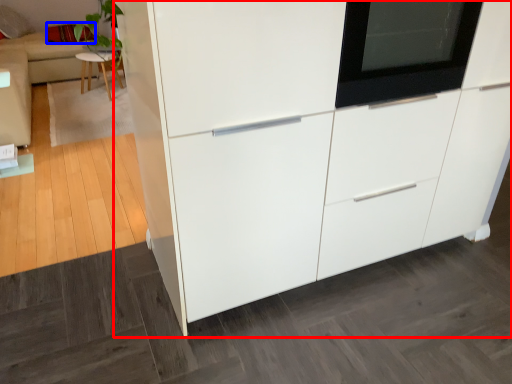
Question: Among these objects, which one is nearest to the camera, cabinetry (highlighted by a red box) or pillow (highlighted by a blue box)?

Choices:
 (A) cabinetry
 (B) pillow

Answer: (A)